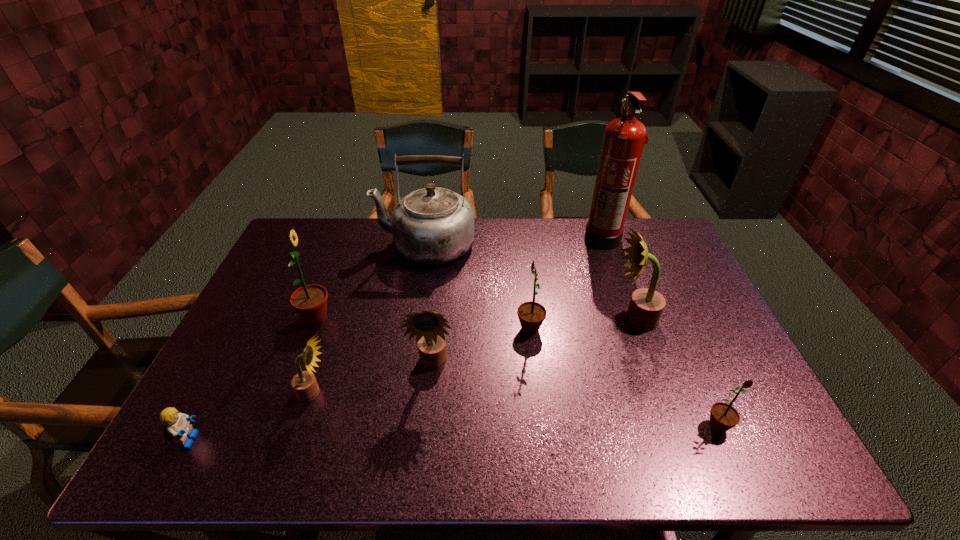
At what (x,y) coordinates should I click in order to perform the action: click on fire extinguisher. Please return your answer as a coordinate pair (x, y). Looking at the image, I should click on (624, 138).

This screenshot has width=960, height=540. I want to click on kettle, so 433,225.

Locate an element on the screen. the fifth sunflower from left to right is located at coordinates (646, 306).

I want to click on the farthest yellow sunflower, so click(x=646, y=306).

Identify the location of the biggest green sunflower. (310, 301).

I want to click on the fourth object from right to left, so click(531, 315).

Image resolution: width=960 pixels, height=540 pixels. In order to click on the second biggest green sunflower in this screenshot , I will do [531, 315].

This screenshot has height=540, width=960. I want to click on the second biggest yellow sunflower, so [x=428, y=327].

You are a GUI agent. You are given a task and a screenshot of the screen. Output one action in this format:
    pyautogui.click(x=<x>, y=<y>)
    Task: Click on the second yellow sunflower from left to right
    This screenshot has width=960, height=540.
    Given the screenshot: What is the action you would take?
    pyautogui.click(x=428, y=327)

You are a GUI agent. You are given a task and a screenshot of the screen. Output one action in this format:
    pyautogui.click(x=<x>, y=<y>)
    Task: Click on the smallest yellow sunflower
    Image resolution: width=960 pixels, height=540 pixels.
    Given the screenshot: What is the action you would take?
    pyautogui.click(x=304, y=384)